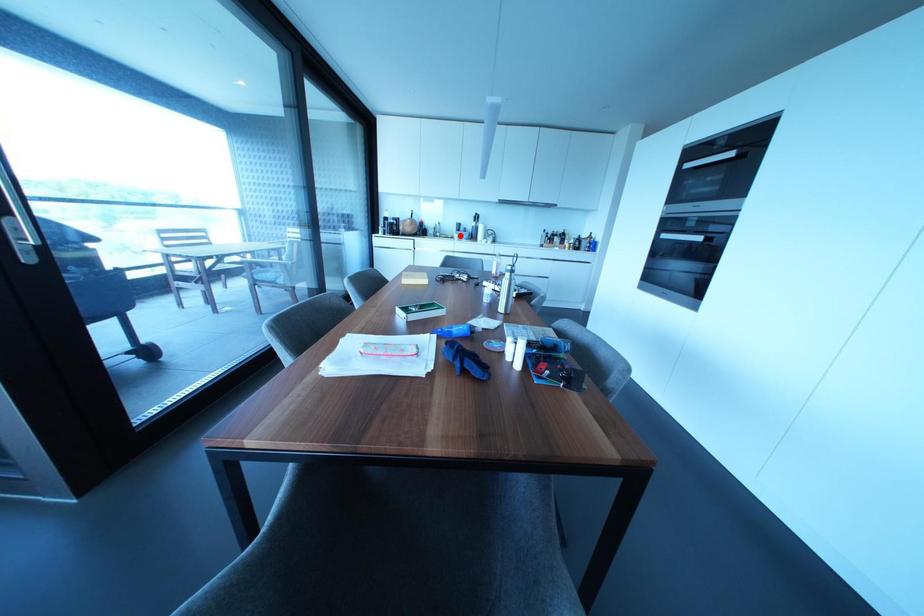
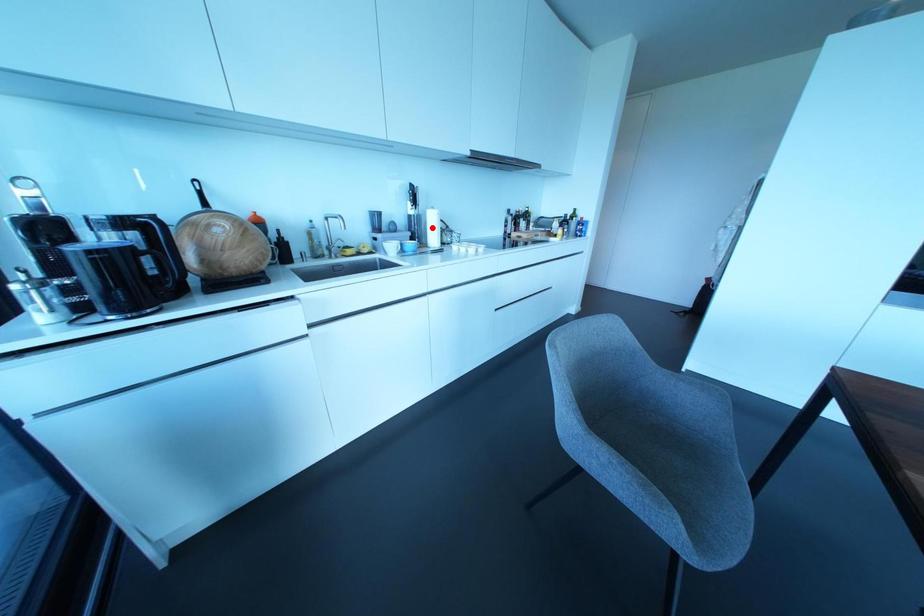
I am providing you with two images of the same scene from different viewpoints. A red point is marked on the first image and another point is marked on the second image. Is the marked point in image1 the same physical position as the marked point in image2?

No